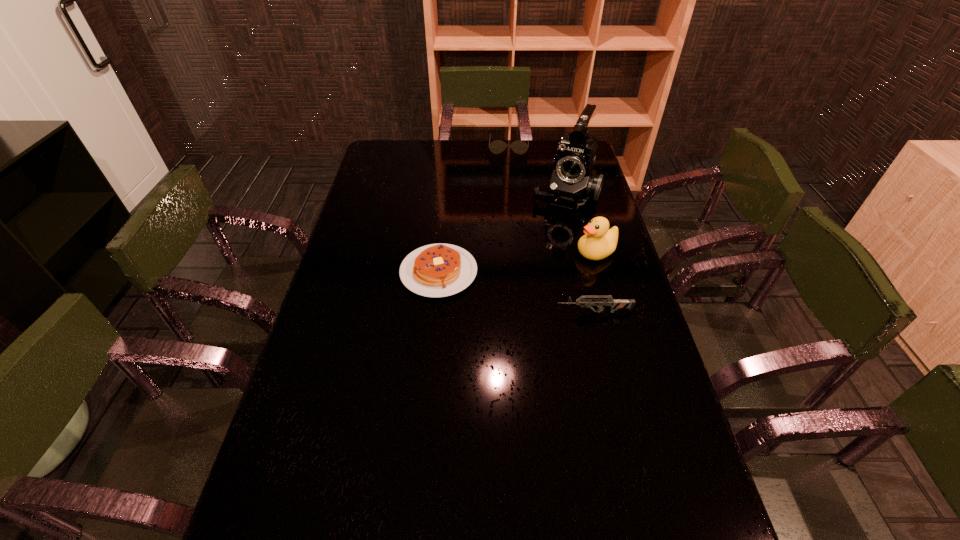
At what (x,y) coordinates should I click in order to perform the action: click on free space between the duck and the tallest object. Please return your answer as a coordinate pair (x, y). The image size is (960, 540). Looking at the image, I should click on (581, 223).

The width and height of the screenshot is (960, 540). I want to click on vacant area that lies between the fourth shortest object and the pancake, so click(517, 262).

The height and width of the screenshot is (540, 960). In order to click on free point between the tallest object and the sunglasses in this screenshot , I will do `click(537, 171)`.

Image resolution: width=960 pixels, height=540 pixels. Find the location of `free space between the gun and the tallest object`. free space between the gun and the tallest object is located at coordinates (580, 253).

Identify the location of vacant space that is in between the shortest object and the duck. The height and width of the screenshot is (540, 960). click(517, 262).

Where is `empty location between the nearest object and the farthest object`? This screenshot has width=960, height=540. empty location between the nearest object and the farthest object is located at coordinates (551, 230).

Identify the location of free space between the second farthest object and the farthest object. (537, 171).

Where is `unoccupied position between the shortest object and the nearest object`? Image resolution: width=960 pixels, height=540 pixels. unoccupied position between the shortest object and the nearest object is located at coordinates (516, 292).

Locate which object is the closest to the nearest object. Please provide its 2D coordinates. Your answer should be formatted as a tuple, i.e. [(x, y)], where the tuple contains the x and y coordinates of a point satisfying the conditions above.

[(599, 241)]

Identify the location of the closest object to the gun. (599, 241).